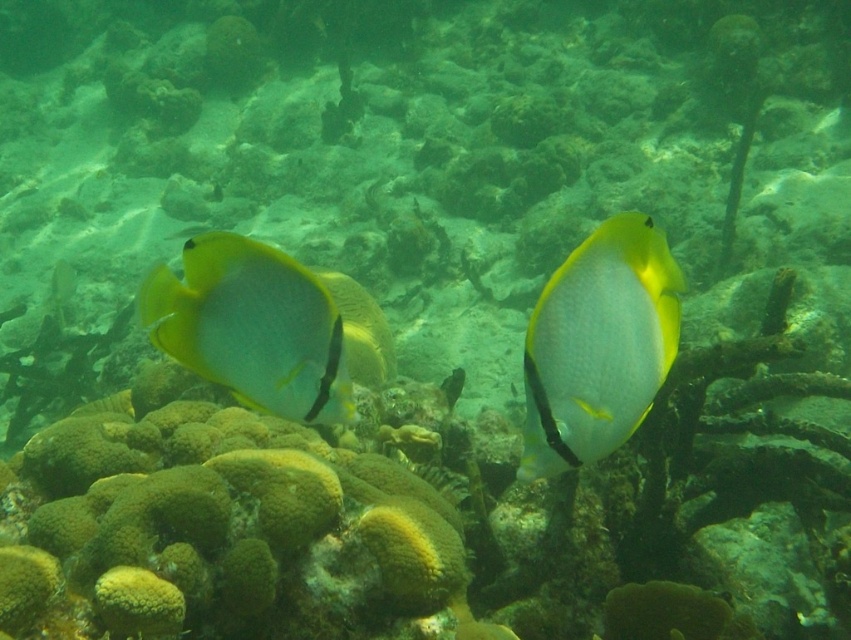
You are a marine biologist observing the underwater scene. You notice two fish labeled as shiny yellow fish at center and translucent yellow fish at center. Which fish is positioned lower in the water?

The shiny yellow fish at center is located below the translucent yellow fish at center, so it is positioned lower in the water.

You are a marine biologist observing the underwater scene. You notice two fish labeled as shiny yellow fish at center and translucent yellow fish at center. Which fish is closer to you, the observer?

The shiny yellow fish at center is closer to you because it is positioned in front of the translucent yellow fish at center.

You are a marine biologist observing the underwater scene. You notice two fish at the center of the image. Which fish is taller between the shiny yellow fish at center and the translucent yellow fish at center?

The shiny yellow fish at center is taller than the translucent yellow fish at center according to the description.